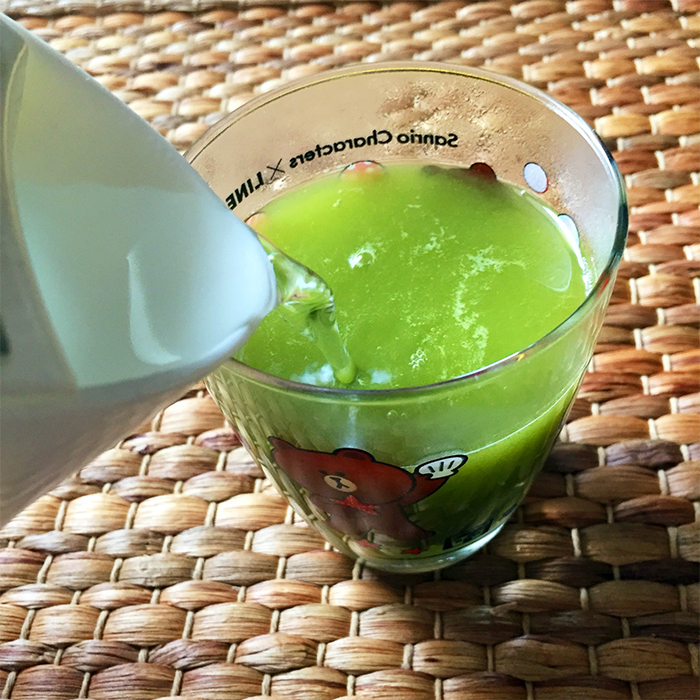
Where is `white carafe`? The height and width of the screenshot is (700, 700). white carafe is located at coordinates (63, 432).